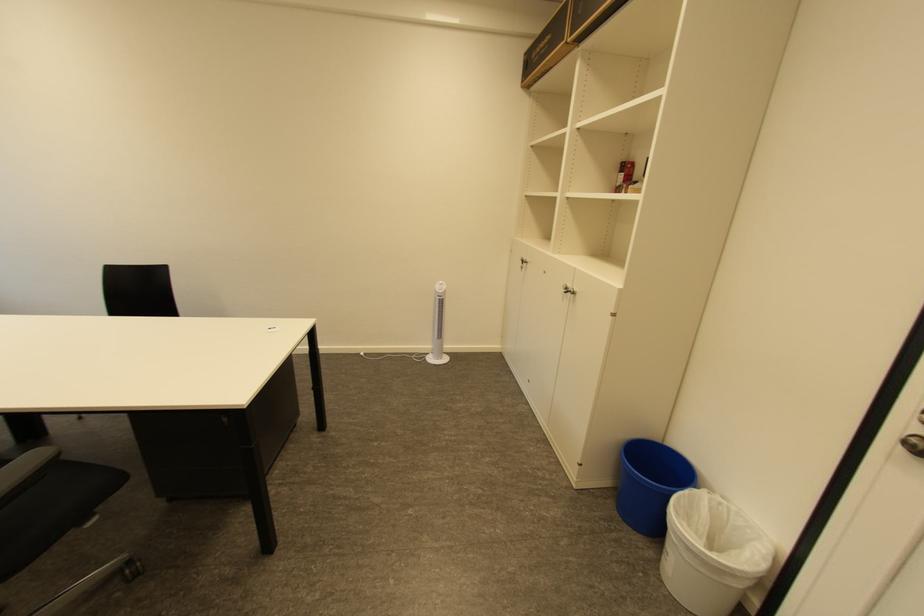
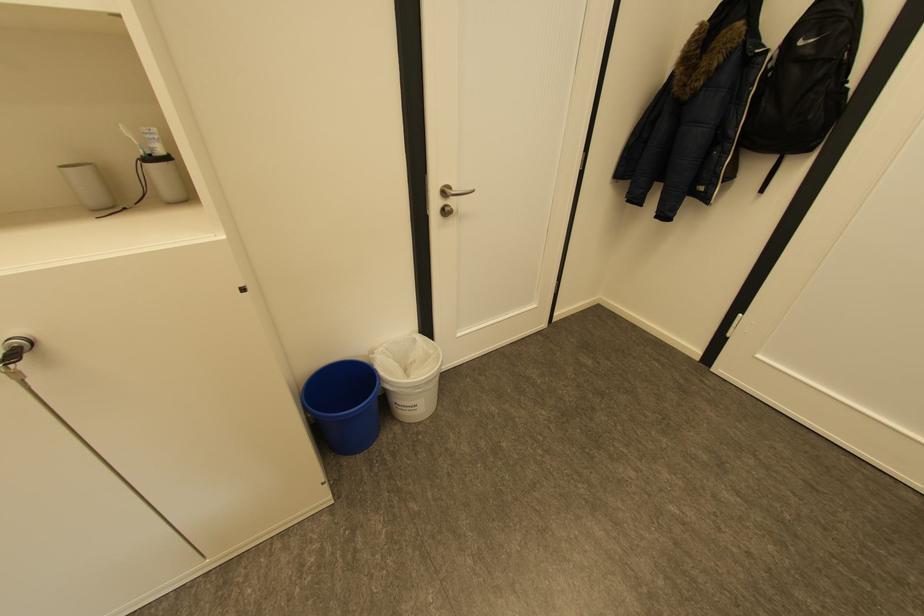
The point at (736,509) is marked in the first image. Where is the corresponding point in the second image?

(394, 349)